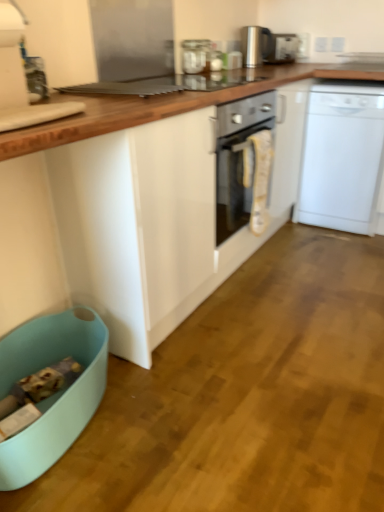
Question: Would you say white plastic dishwasher at right is outside polished stainless steel kettle at upper center, the second kitchen appliance in the front-to-back sequence?

Choices:
 (A) yes
 (B) no

Answer: (A)

Question: Is polished stainless steel kettle at upper center, marked as the 2th kitchen appliance in a bottom-to-top arrangement, inside white plastic dishwasher at right?

Choices:
 (A) yes
 (B) no

Answer: (B)

Question: Does white plastic dishwasher at right turn towards polished stainless steel kettle at upper center, which appears as the first kitchen appliance when viewed from the top?

Choices:
 (A) yes
 (B) no

Answer: (B)

Question: From a real-world perspective, is white plastic dishwasher at right over polished stainless steel kettle at upper center, positioned as the 1th kitchen appliance in right-to-left order?

Choices:
 (A) no
 (B) yes

Answer: (A)

Question: Does white plastic dishwasher at right have a greater height compared to polished stainless steel kettle at upper center, marked as the 2th kitchen appliance in a bottom-to-top arrangement?

Choices:
 (A) no
 (B) yes

Answer: (B)

Question: From their relative heights in the image, would you say polished stainless steel kettle at upper center, which appears as the first kitchen appliance when viewed from the top, is taller or shorter than light blue plastic dish washer at lower left?

Choices:
 (A) tall
 (B) short

Answer: (A)

Question: Relative to light blue plastic dish washer at lower left, is polished stainless steel kettle at upper center, the second kitchen appliance in the front-to-back sequence, in front or behind?

Choices:
 (A) front
 (B) behind

Answer: (B)

Question: Would you say polished stainless steel kettle at upper center, which appears as the first kitchen appliance when viewed from the top, is inside or outside light blue plastic dish washer at lower left?

Choices:
 (A) inside
 (B) outside

Answer: (B)

Question: Considering the positions of point (256, 28) and point (14, 344), is point (256, 28) closer or farther from the camera than point (14, 344)?

Choices:
 (A) closer
 (B) farther

Answer: (B)

Question: Is clear glass jar at upper center, the first kitchen appliance when ordered from bottom to top, situated inside satin silver toaster at upper center or outside?

Choices:
 (A) outside
 (B) inside

Answer: (A)

Question: Is clear glass jar at upper center, positioned as the 2th kitchen appliance in top-to-bottom order, taller or shorter than satin silver toaster at upper center?

Choices:
 (A) short
 (B) tall

Answer: (A)

Question: Is clear glass jar at upper center, which appears as the 1th kitchen appliance when viewed from the front, bigger or smaller than satin silver toaster at upper center?

Choices:
 (A) big
 (B) small

Answer: (B)

Question: From a real-world perspective, relative to satin silver toaster at upper center, is clear glass jar at upper center, which is the second kitchen appliance from back to front, vertically above or below?

Choices:
 (A) above
 (B) below

Answer: (B)

Question: Is point (104, 380) positioned closer to the camera than point (100, 156)?

Choices:
 (A) closer
 (B) farther

Answer: (B)

Question: From the image's perspective, is light blue plastic dish washer at lower left positioned above or below white glossy cabinet at center?

Choices:
 (A) below
 (B) above

Answer: (A)